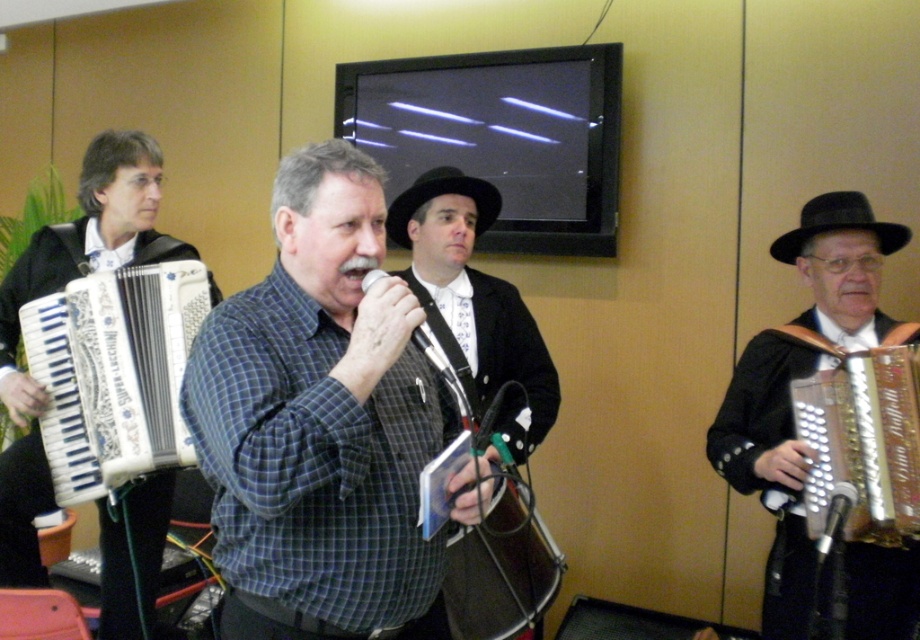
You are standing in front of the image and want to touch the two points mentioned. Which point should you reach for first, point (152, 545) or point (825, 513)?

Point (152, 545) is closer to you than point (825, 513), so you should reach for point (152, 545) first.

You are a photographer trying to capture a wide shot of the stage. The shiny gold accordion at right and the white matte accordion at left are both in your frame. Which accordion takes up more horizontal space in the photo?

The white matte accordion at left takes up more horizontal space in the photo because it has a greater width than the shiny gold accordion at right.

You are a photographer at the event and want to capture a clear photo of both the shiny gold accordion at right and the white matte accordion at left. Which accordion should you focus on first to ensure both are in focus?

The shiny gold accordion at right is in front of the white matte accordion at left. To ensure both are in focus, you should focus on the shiny gold accordion at right first, as it is closer to the camera.